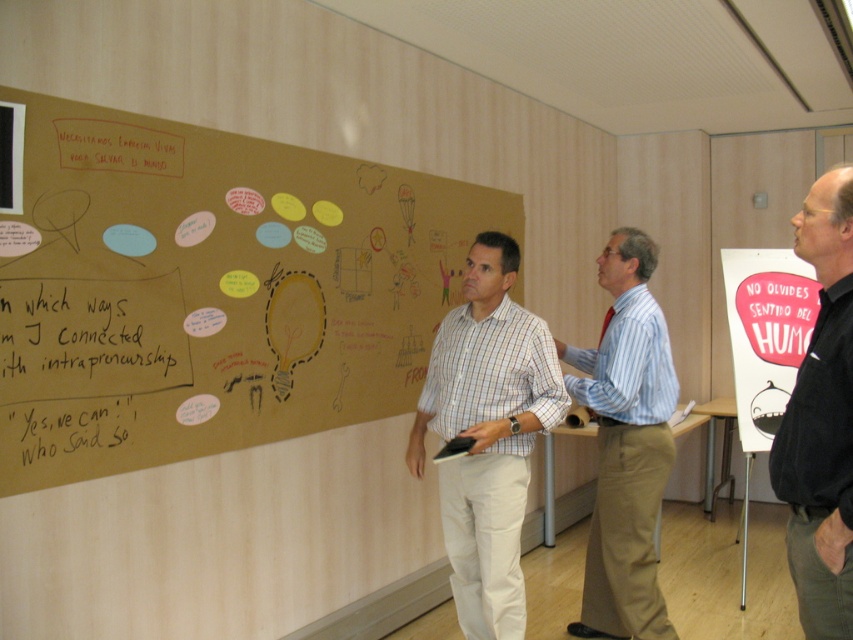
Question: Which object is the farthest from the white chalk writing at left?

Choices:
 (A) light blue striped shirt at center
 (B) plaid cotton shirt at center
 (C) black cotton shirt at right

Answer: (C)

Question: Which object is positioned farthest from the plaid cotton shirt at center?

Choices:
 (A) brown cardboard at upper left
 (B) light blue striped shirt at center
 (C) black cotton shirt at right
 (D) white chalk writing at left

Answer: (D)

Question: Can you confirm if plaid cotton shirt at center is positioned to the right of white chalk writing at left?

Choices:
 (A) no
 (B) yes

Answer: (B)

Question: Which is nearer to the light blue striped shirt at center?

Choices:
 (A) white chalk writing at left
 (B) black cotton shirt at right
 (C) brown cardboard at upper left
 (D) plaid cotton shirt at center

Answer: (D)

Question: Does plaid cotton shirt at center have a lesser width compared to black cotton shirt at right?

Choices:
 (A) no
 (B) yes

Answer: (A)

Question: Can you confirm if brown cardboard at upper left is positioned to the right of black cotton shirt at right?

Choices:
 (A) yes
 (B) no

Answer: (B)